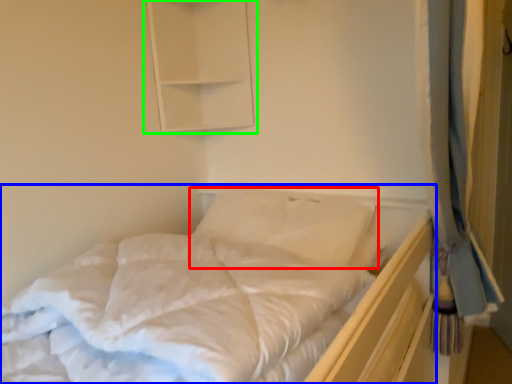
Question: Estimate the real-world distances between objects in this image. Which object is closer to pillow (highlighted by a red box), bed (highlighted by a blue box) or medicine cabinet (highlighted by a green box)?

Choices:
 (A) bed
 (B) medicine cabinet

Answer: (A)